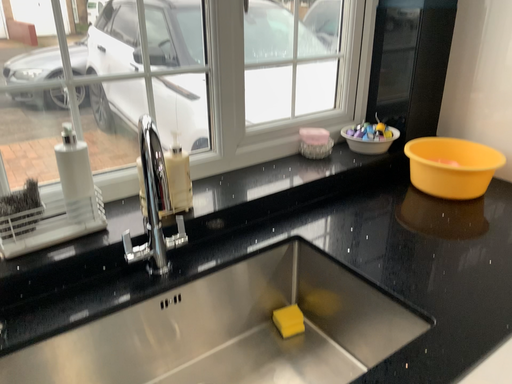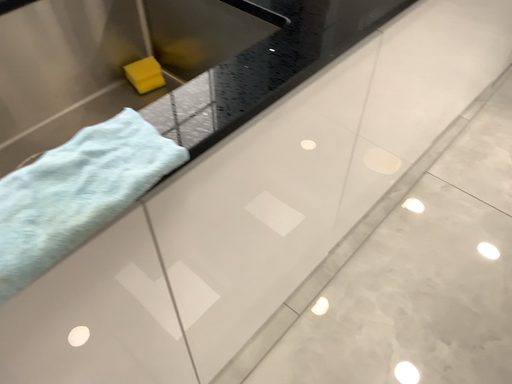
Question: How did the camera likely rotate when shooting the video?

Choices:
 (A) rotated downward
 (B) rotated upward

Answer: (A)